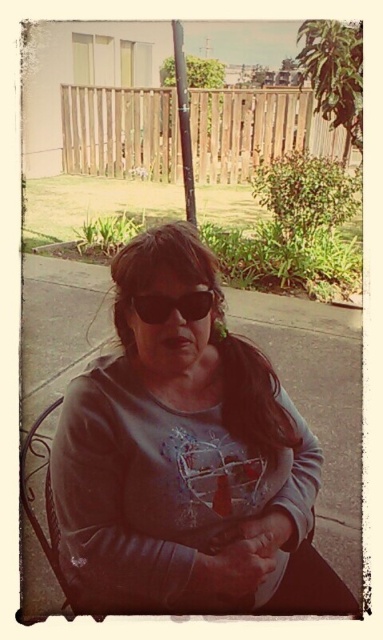
You are a fashion designer observing the person in the image. You need to determine the spatial relationship between the gray fleece sweatshirt at center and the black plastic sunglasses at center. Which object is positioned to the right?

The gray fleece sweatshirt at center is positioned to the right of the black plastic sunglasses at center.

You are a fashion designer observing the person in the scene. You need to determine which item of clothing or accessory is higher on the person. Which one is taller between the gray fleece sweatshirt at center and the black plastic sunglasses at center?

The gray fleece sweatshirt at center is taller than the black plastic sunglasses at center.